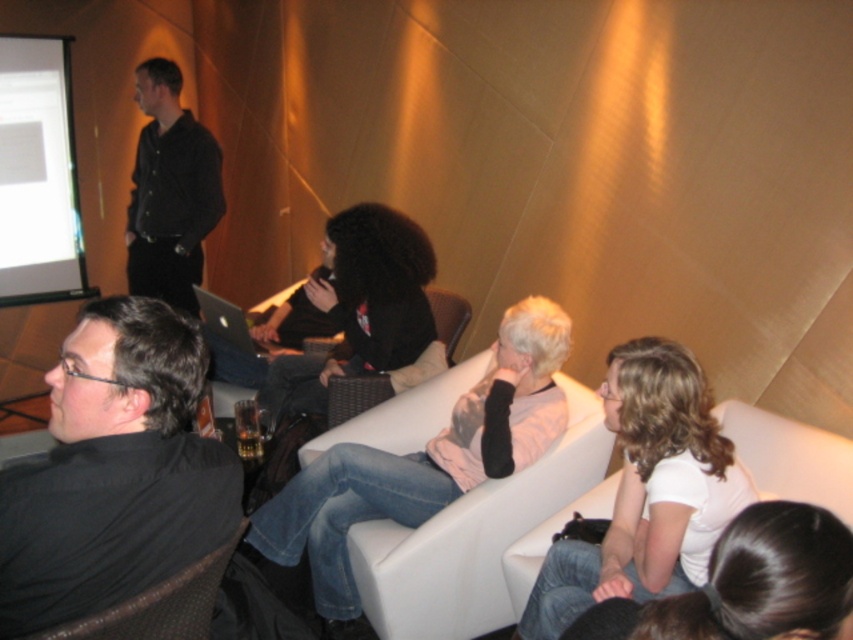
Question: Is black matte shirt at lower left positioned before brown woven chair at lower left?

Choices:
 (A) yes
 (B) no

Answer: (B)

Question: Among these points, which one is nearest to the camera?

Choices:
 (A) (53, 224)
 (B) (352, 209)
 (C) (315, 307)

Answer: (C)

Question: Among these objects, which one is farthest from the camera?

Choices:
 (A) woven wicker chair at center
 (B) light pink fabric jacket at center
 (C) matte black laptop at center
 (D) black matte shirt at center

Answer: (C)

Question: Is white glossy projection screen at upper left positioned at the back of woven wicker chair at center?

Choices:
 (A) yes
 (B) no

Answer: (A)

Question: Among these points, which one is farthest from the camera?

Choices:
 (A) (39, 208)
 (B) (73, 602)
 (C) (271, 497)
 (D) (138, 596)

Answer: (A)

Question: Is black matte shirt at lower left below white matte shirt at lower right?

Choices:
 (A) no
 (B) yes

Answer: (A)